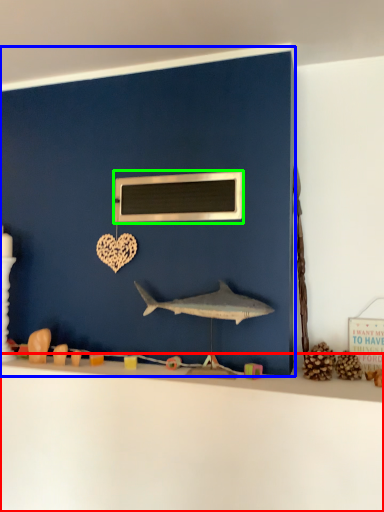
Question: Estimate the real-world distances between objects in this image. Which object is farther from counter top (highlighted by a red box), backdrop (highlighted by a blue box) or medicine cabinet (highlighted by a green box)?

Choices:
 (A) backdrop
 (B) medicine cabinet

Answer: (B)